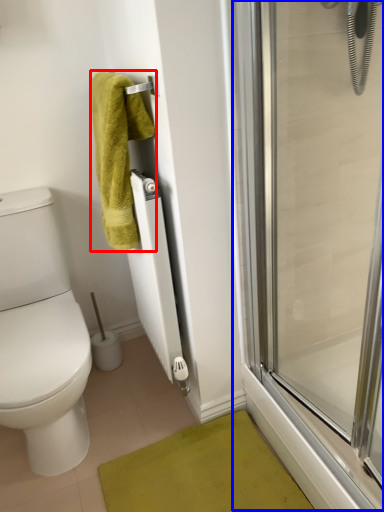
Question: Among these objects, which one is nearest to the camera, towel (highlighted by a red box) or screen door (highlighted by a blue box)?

Choices:
 (A) towel
 (B) screen door

Answer: (B)